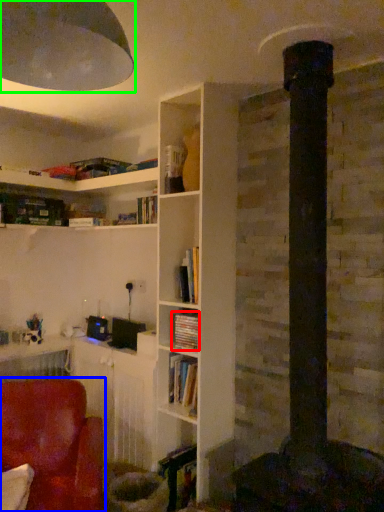
Question: Considering the real-world distances, which object is farthest from book (highlighted by a red box)? chair (highlighted by a blue box) or lamp (highlighted by a green box)?

Choices:
 (A) chair
 (B) lamp

Answer: (B)